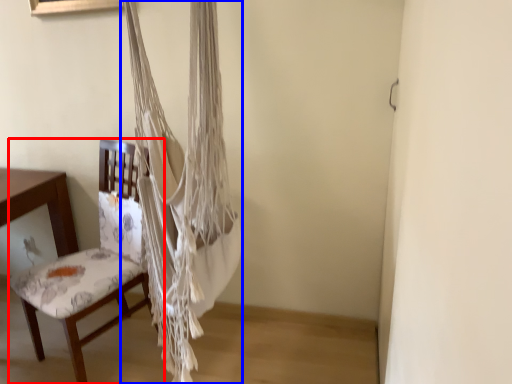
Question: Which object appears closest to the camera in this image, chair (highlighted by a red box) or curtain (highlighted by a blue box)?

Choices:
 (A) chair
 (B) curtain

Answer: (B)